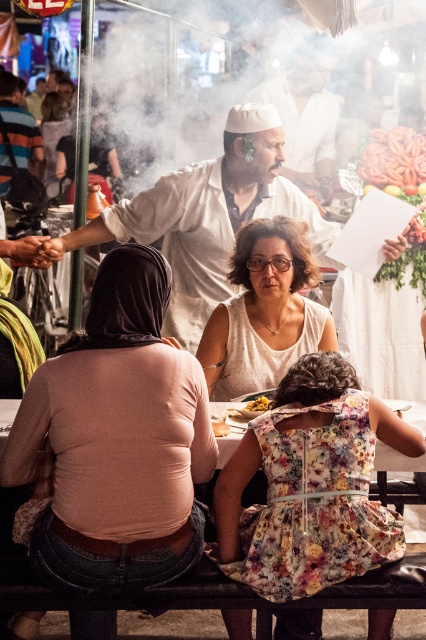
You are a food vendor at this busy street market and want to place a new menu board made of pale pink fabric at center and golden crispy fries at center on the same table. Considering their sizes, which one should you place first to ensure both fit comfortably?

Since the pale pink fabric at center is wider than the golden crispy fries at center, you should place the pale pink fabric at center first to ensure there is enough space for both items on the table.

You are a photographer trying to capture the scene from the left side of the table. You want to ensure both the white cotton shirt at center and the smooth yellow bread at lower center are visible in your shot. Based on their positions, which object should appear closer to the right side of your photo?

The white cotton shirt at center is positioned to the right of the smooth yellow bread at lower center, so in the photo taken from the left side of the table, the white cotton shirt at center will appear closer to the right side.

You are a photographer standing at the edge of the lively street food scene. You want to take a photo of the white cotton shirt at center and the smooth yellow bread at lower center. Which object will appear closer to you in the photo?

The white cotton shirt at center will appear closer to you in the photo because it is positioned further to the viewer than the smooth yellow bread at lower center.